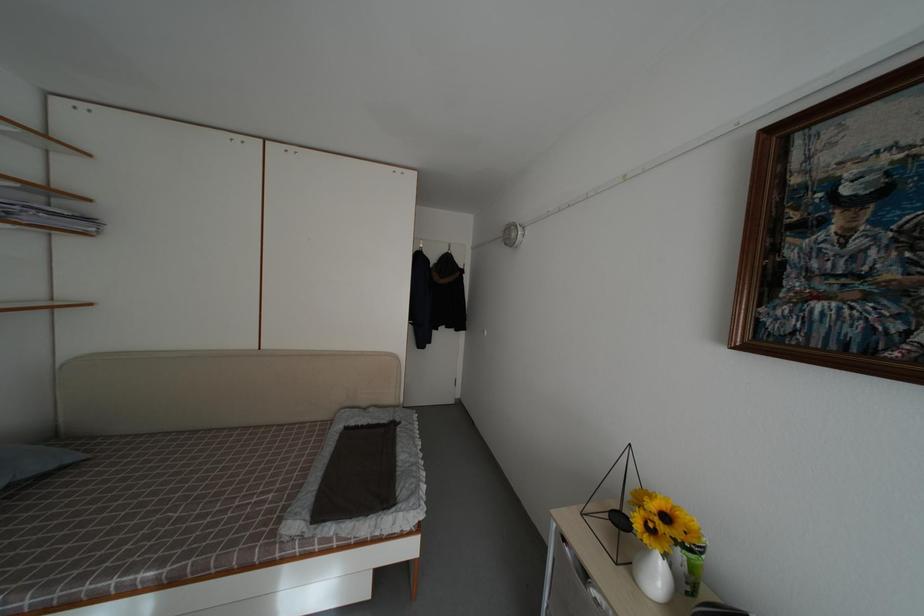
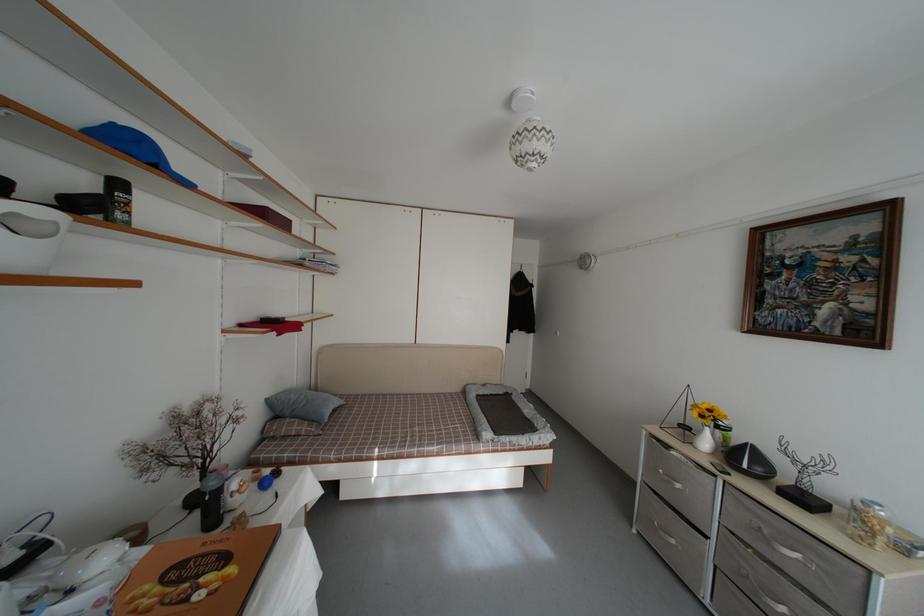
Where in the second image is the point corresponding to point 699,576 from the first image?

(731, 446)